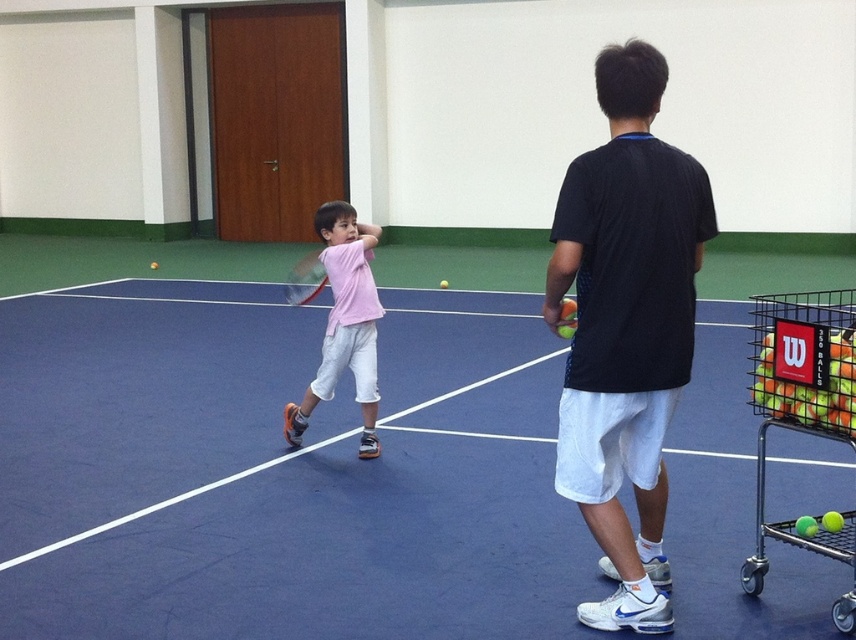
Is the position of green rubber tennis ball cart at right more distant than that of pink matte shirt at center?

No, green rubber tennis ball cart at right is in front of pink matte shirt at center.

The image size is (856, 640). I want to click on green rubber tennis ball cart at right, so click(803, 412).

Is point (568, 440) positioned behind point (294, 280)?

No, it is in front of (294, 280).

Is point (631, 612) behind point (290, 301)?

No, (631, 612) is closer to viewer.

Where is `black fabric shirt at center`? The image size is (856, 640). black fabric shirt at center is located at coordinates (626, 326).

Which of these two, black fabric shirt at center or yellow-green rubber tennis balls at lower right, stands shorter?

yellow-green rubber tennis balls at lower right is shorter.

Is black fabric shirt at center further to camera compared to yellow-green rubber tennis balls at lower right?

No.

This screenshot has width=856, height=640. Find the location of `black fabric shirt at center`. black fabric shirt at center is located at coordinates (626, 326).

You are a GUI agent. You are given a task and a screenshot of the screen. Output one action in this format:
    pyautogui.click(x=<x>, y=<y>)
    Task: Click on the black fabric shirt at center
    The width and height of the screenshot is (856, 640).
    Given the screenshot: What is the action you would take?
    pyautogui.click(x=626, y=326)